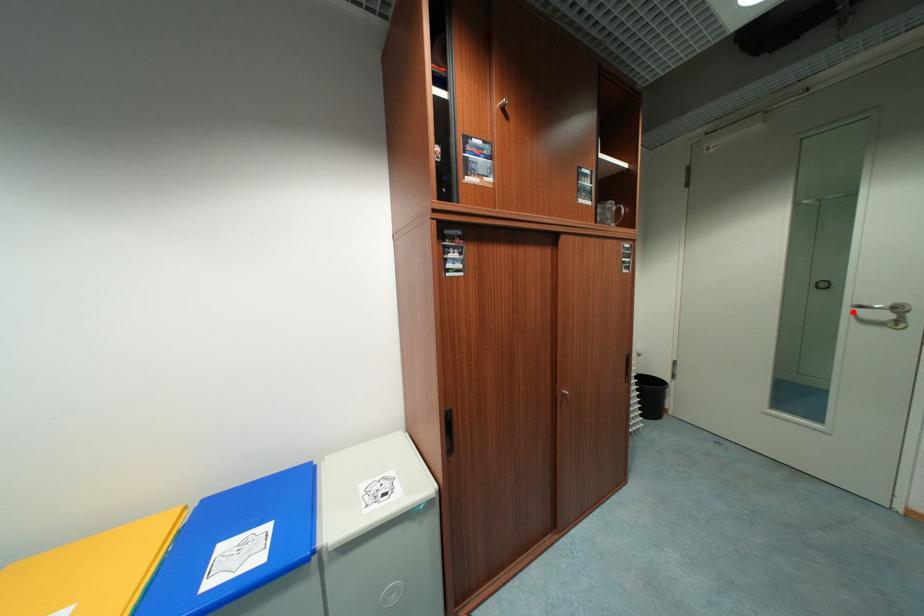
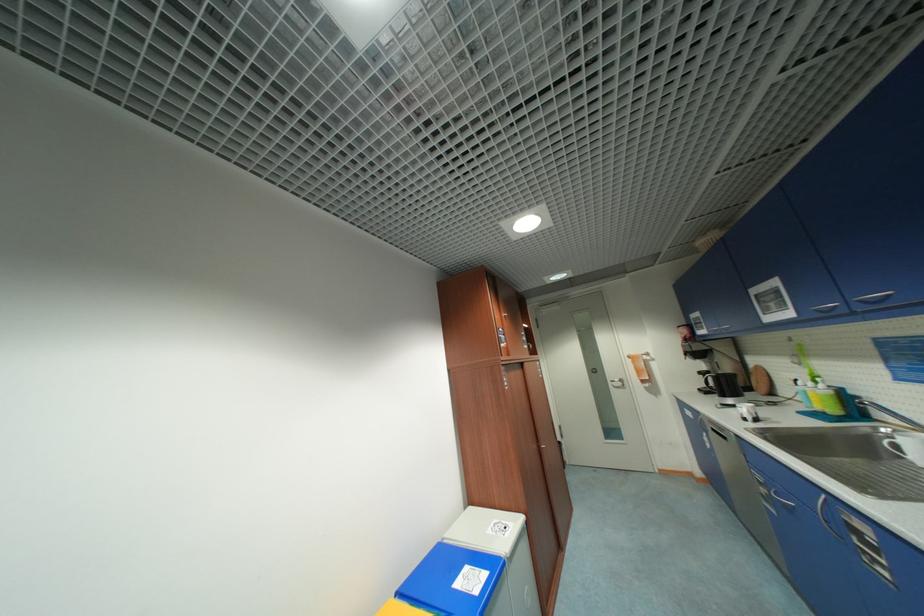
Question: I am providing you with two images of the same scene from different viewpoints. A red point is shown in image1. For the corresponding object point in image2, is it positioned nearer or farther from the camera?

Choices:
 (A) Nearer
 (B) Farther

Answer: (B)